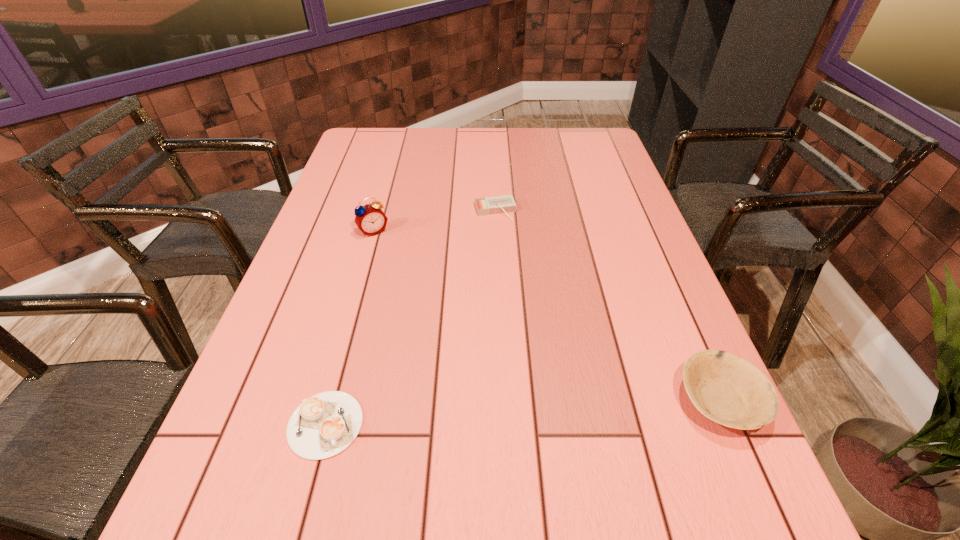
Locate an element on the screen. free space in the image that satisfies the following two spatial constraints: 1. on the back side of the bowl; 2. on the right side of the cappuccino is located at coordinates (332, 401).

At what (x,y) coordinates should I click in order to perform the action: click on free spot that satisfies the following two spatial constraints: 1. on the back side of the cappuccino; 2. on the left side of the rightmost object. Please return your answer as a coordinate pair (x, y). The height and width of the screenshot is (540, 960). Looking at the image, I should click on (332, 401).